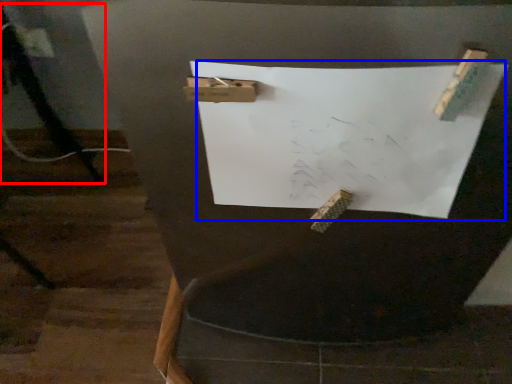
Question: Which point is closer to the camera, tripod (highlighted by a red box) or paper (highlighted by a blue box)?

Choices:
 (A) tripod
 (B) paper

Answer: (B)